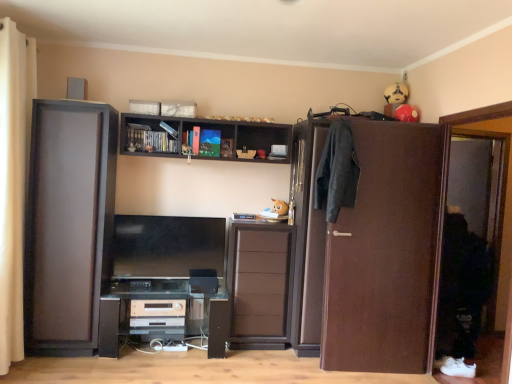
Question: Which is correct: matte black cupboard at left is inside dark gray fabric coat at right, or outside of it?

Choices:
 (A) inside
 (B) outside

Answer: (B)

Question: In terms of height, does matte black cupboard at left look taller or shorter compared to dark gray fabric coat at right?

Choices:
 (A) tall
 (B) short

Answer: (A)

Question: Which object is positioned farthest from the beige fabric curtain at left?

Choices:
 (A) brown matte door at right
 (B) silver metallic stereo at center, the first appliance positioned from the bottom
 (C) black plastic computer desk at lower center
 (D) dark gray fabric coat at right
 (E) brown matte cabinet at center

Answer: (A)

Question: Based on their relative distances, which object is farther from the silver metallic stereo at center, which ranks as the first appliance in left-to-right order?

Choices:
 (A) satin black speaker at center, marked as the second appliance in a left-to-right arrangement
 (B) beige fabric curtain at left
 (C) brown wooden screen door at right
 (D) brown matte cabinet at center
 (E) dark gray fabric coat at right

Answer: (C)